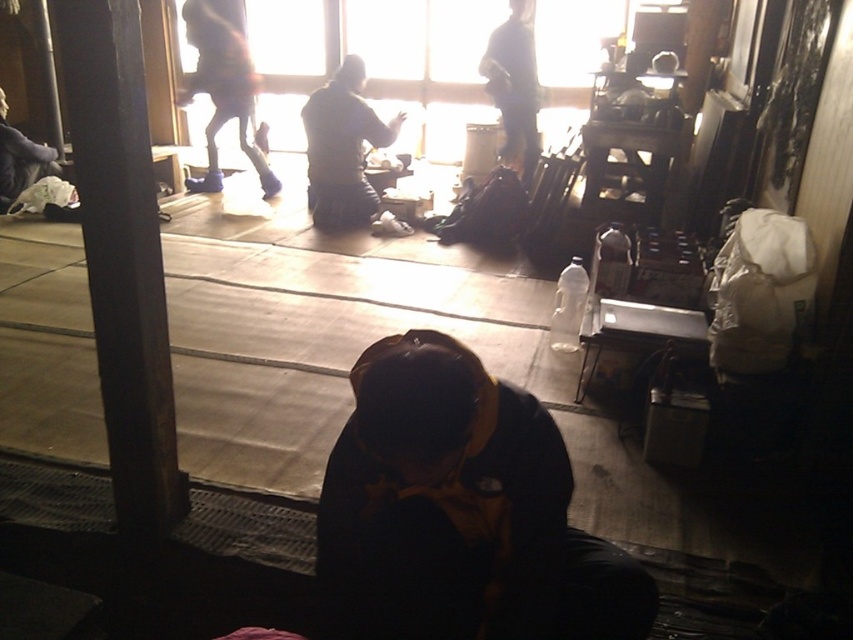
You are organizing a small event in this space and need to cover a table with a fabric. You have both the dark yellow fabric at center and the dark gray fabric jacket at center. Which fabric would you choose to cover the table if you want to ensure full coverage?

The dark gray fabric jacket at center is larger than the dark yellow fabric at center, so it would provide better coverage for the table.

You are a person in the image and you want to see the dark gray fabric jacket at center without moving your head. Can you see it through the dark yellow fabric at center?

The dark yellow fabric at center is in front of the dark gray fabric jacket at center, so you cannot see the dark gray fabric jacket at center through the dark yellow fabric at center.